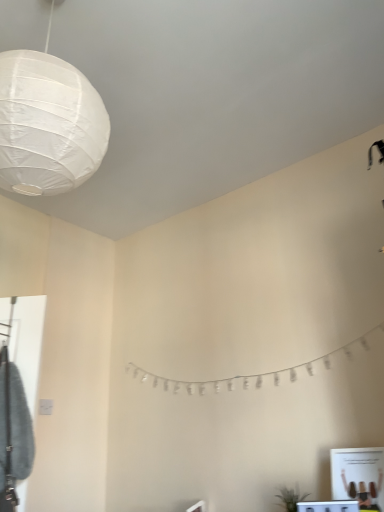
I want to click on white paper garland at center, so click(256, 374).

Describe the element at coordinates (256, 374) in the screenshot. I see `white paper garland at center` at that location.

Find the location of a particular element. This screenshot has height=512, width=384. green matte plant at lower right is located at coordinates (290, 498).

The width and height of the screenshot is (384, 512). In order to click on white paper garland at center in this screenshot , I will do `click(256, 374)`.

Do you think white paper lantern at upper left is within white glossy vanity at lower right, or outside of it?

white paper lantern at upper left is not enclosed by white glossy vanity at lower right.

Consider the image. Which object is further away from the camera taking this photo, white paper lantern at upper left or white glossy vanity at lower right?

white glossy vanity at lower right is more distant.

Is white paper lantern at upper left not near white glossy vanity at lower right?

white paper lantern at upper left is positioned a significant distance from white glossy vanity at lower right.

Locate an element on the screen. Image resolution: width=384 pixels, height=512 pixels. lantern above the white glossy vanity at lower right (from the image's perspective) is located at coordinates (48, 124).

Is white paper lantern at upper left completely or partially inside green matte plant at lower right?

No, white paper lantern at upper left is located outside of green matte plant at lower right.

What's the angular difference between green matte plant at lower right and white paper lantern at upper left's facing directions?

The angular difference between green matte plant at lower right and white paper lantern at upper left is 84.8 degrees.

Does green matte plant at lower right have a lesser width compared to white paper lantern at upper left?

Indeed, green matte plant at lower right has a lesser width compared to white paper lantern at upper left.

Considering the relative sizes of white paper lantern at upper left and white paper garland at center in the image provided, is white paper lantern at upper left shorter than white paper garland at center?

No, white paper lantern at upper left is not shorter than white paper garland at center.

Do you think white paper lantern at upper left is within white paper garland at center, or outside of it?

white paper lantern at upper left is located beyond the bounds of white paper garland at center.

Considering the positions of objects white paper lantern at upper left and white paper garland at center in the image provided, who is in front, white paper lantern at upper left or white paper garland at center?

white paper lantern at upper left is closer to the camera.

Would you say white paper lantern at upper left is to the left or to the right of white paper garland at center in the picture?

In the image, white paper lantern at upper left appears on the left side of white paper garland at center.

From the image's perspective, who appears lower, white paper garland at center or green matte plant at lower right?

green matte plant at lower right.

Visually, is white paper garland at center positioned to the left or to the right of green matte plant at lower right?

Clearly, white paper garland at center is on the left of green matte plant at lower right in the image.

Is white paper garland at center taller or shorter than green matte plant at lower right?

white paper garland at center is taller than green matte plant at lower right.

Can green matte plant at lower right be found inside white paper garland at center?

No, green matte plant at lower right is not surrounded by white paper garland at center.

From a real-world perspective, is green matte plant at lower right physically located above or below white paper garland at center?

green matte plant at lower right is situated lower than white paper garland at center in the real world.

Which of these two, green matte plant at lower right or white paper garland at center, stands shorter?

green matte plant at lower right.

From the image's perspective, would you say green matte plant at lower right is shown under white paper garland at center?

Yes, from the image's perspective, green matte plant at lower right is beneath white paper garland at center.

Is green matte plant at lower right located outside white glossy vanity at lower right?

green matte plant at lower right lies outside white glossy vanity at lower right's area.

Could you tell me if green matte plant at lower right is facing white glossy vanity at lower right?

No, green matte plant at lower right is not facing towards white glossy vanity at lower right.

Which of these two, green matte plant at lower right or white glossy vanity at lower right, is wider?

green matte plant at lower right is wider.

From a real-world perspective, is green matte plant at lower right positioned under white glossy vanity at lower right based on gravity?

No, from a real-world perspective, green matte plant at lower right is not beneath white glossy vanity at lower right.

From the image's perspective, would you say white glossy vanity at lower right is shown under white paper garland at center?

Yes, from the image's perspective, white glossy vanity at lower right is beneath white paper garland at center.

How many degrees apart are the facing directions of white glossy vanity at lower right and white paper garland at center?

21.8 degrees separate the facing orientations of white glossy vanity at lower right and white paper garland at center.

Is white glossy vanity at lower right next to white paper garland at center and touching it?

There is a gap between white glossy vanity at lower right and white paper garland at center.

Which is in front, white glossy vanity at lower right or white paper garland at center?

Positioned in front is white glossy vanity at lower right.

I want to click on vanity that is on the right side of white paper lantern at upper left, so click(329, 506).

Find the location of `plant lying below the white paper lantern at upper left (from the image's perspective)`. plant lying below the white paper lantern at upper left (from the image's perspective) is located at coordinates click(290, 498).

Consider the image. Estimate the real-world distances between objects in this image. Which object is closer to green matte plant at lower right, white paper lantern at upper left or white paper garland at center?

white paper garland at center.

Estimate the real-world distances between objects in this image. Which object is closer to white paper lantern at upper left, green matte plant at lower right or white paper garland at center?

white paper garland at center lies closer to white paper lantern at upper left than the other object.

From the image, which object appears to be nearer to white paper garland at center, green matte plant at lower right or white glossy vanity at lower right?

green matte plant at lower right is positioned closer to the anchor white paper garland at center.

Looking at the image, which one is located further to white paper garland at center, white glossy vanity at lower right or green matte plant at lower right?

Based on the image, white glossy vanity at lower right appears to be further to white paper garland at center.

From the picture: Looking at the image, which one is located further to white glossy vanity at lower right, green matte plant at lower right or white paper garland at center?

The object further to white glossy vanity at lower right is white paper garland at center.

Estimate the real-world distances between objects in this image. Which object is closer to white glossy vanity at lower right, white paper lantern at upper left or green matte plant at lower right?

green matte plant at lower right lies closer to white glossy vanity at lower right than the other object.

Looking at the image, which one is located closer to white glossy vanity at lower right, white paper garland at center or green matte plant at lower right?

Among the two, green matte plant at lower right is located nearer to white glossy vanity at lower right.

Considering their positions, is white paper lantern at upper left positioned further to white paper garland at center than white glossy vanity at lower right?

white paper lantern at upper left.

The image size is (384, 512). Find the location of `vanity between white paper garland at center and green matte plant at lower right from top to bottom`. vanity between white paper garland at center and green matte plant at lower right from top to bottom is located at coordinates (329, 506).

This screenshot has height=512, width=384. Find the location of `vanity between white paper lantern at upper left and green matte plant at lower right vertically`. vanity between white paper lantern at upper left and green matte plant at lower right vertically is located at coordinates (329, 506).

Locate an element on the screen. The height and width of the screenshot is (512, 384). clothesline between white paper lantern at upper left and white glossy vanity at lower right in the vertical direction is located at coordinates (256, 374).

Image resolution: width=384 pixels, height=512 pixels. Identify the location of clothesline that lies between white paper lantern at upper left and green matte plant at lower right from top to bottom. (256, 374).